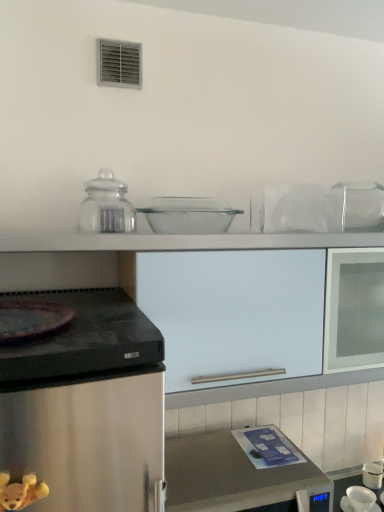
Question: Is metallic stainless steel microwave at lower center closer to the viewer compared to clear glass bowl at center, which appears as the second appliance when viewed from the back?

Choices:
 (A) yes
 (B) no

Answer: (A)

Question: Can you confirm if metallic stainless steel microwave at lower center is smaller than clear glass bowl at center, the 2th appliance viewed from the right?

Choices:
 (A) no
 (B) yes

Answer: (A)

Question: Would you say clear glass bowl at center, which is the 1th appliance from top to bottom, is part of metallic stainless steel microwave at lower center's contents?

Choices:
 (A) no
 (B) yes

Answer: (A)

Question: Is metallic stainless steel microwave at lower center shorter than clear glass bowl at center, the 2th appliance viewed from the right?

Choices:
 (A) yes
 (B) no

Answer: (B)

Question: Can you confirm if metallic stainless steel microwave at lower center is taller than clear glass bowl at center, which is the 1th appliance from top to bottom?

Choices:
 (A) no
 (B) yes

Answer: (B)

Question: Based on their sizes in the image, would you say transparent glass jar at upper center is bigger or smaller than metallic stainless steel microwave at lower center?

Choices:
 (A) big
 (B) small

Answer: (B)

Question: Is transparent glass jar at upper center in front of or behind metallic stainless steel microwave at lower center in the image?

Choices:
 (A) front
 (B) behind

Answer: (B)

Question: Does point (100, 179) appear closer or farther from the camera than point (180, 465)?

Choices:
 (A) farther
 (B) closer

Answer: (B)

Question: Is transparent glass jar at upper center taller or shorter than metallic stainless steel microwave at lower center?

Choices:
 (A) tall
 (B) short

Answer: (B)

Question: In terms of width, does clear glass bowl at center, the 2th appliance viewed from the right, look wider or thinner when compared to brown plush bear at lower left?

Choices:
 (A) thin
 (B) wide

Answer: (B)

Question: From a real-world perspective, is clear glass bowl at center, which is the first appliance from front to back, above or below brown plush bear at lower left?

Choices:
 (A) above
 (B) below

Answer: (A)

Question: Considering the positions of clear glass bowl at center, which appears as the second appliance when viewed from the back, and brown plush bear at lower left in the image, is clear glass bowl at center, which appears as the second appliance when viewed from the back, taller or shorter than brown plush bear at lower left?

Choices:
 (A) tall
 (B) short

Answer: (B)

Question: Considering the positions of clear glass bowl at center, the second appliance positioned from the bottom, and brown plush bear at lower left in the image, is clear glass bowl at center, the second appliance positioned from the bottom, bigger or smaller than brown plush bear at lower left?

Choices:
 (A) small
 (B) big

Answer: (B)

Question: Is transparent glass jar at upper center taller or shorter than white matte cabinet at center?

Choices:
 (A) tall
 (B) short

Answer: (B)

Question: Is point (91, 202) closer or farther from the camera than point (309, 451)?

Choices:
 (A) farther
 (B) closer

Answer: (B)